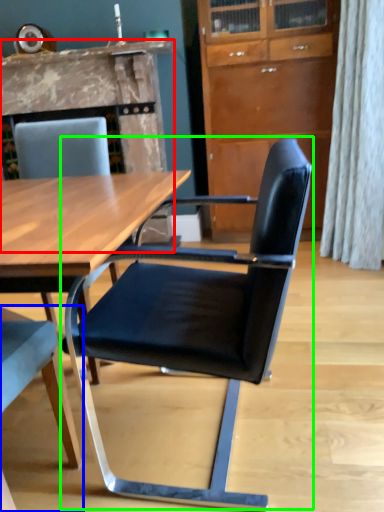
Question: Which object is positioned farthest from fireplace (highlighted by a red box)? Select from chair (highlighted by a blue box) and chair (highlighted by a green box).

Choices:
 (A) chair
 (B) chair

Answer: (A)